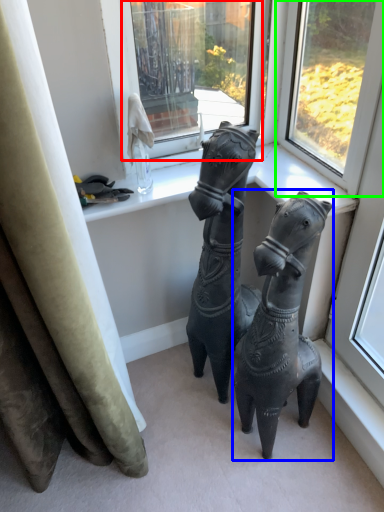
Question: Which object is the farthest from window (highlighted by a red box)? Choose among these: horse (highlighted by a blue box) or window (highlighted by a green box).

Choices:
 (A) horse
 (B) window

Answer: (A)